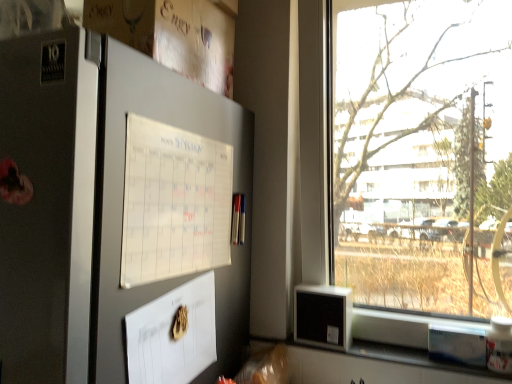
Question: Does white paper calendar at upper left have a smaller size compared to satin silver fridge at left?

Choices:
 (A) no
 (B) yes

Answer: (B)

Question: Is white paper calendar at upper left positioned before satin silver fridge at left?

Choices:
 (A) no
 (B) yes

Answer: (A)

Question: Is white paper calendar at upper left taller than satin silver fridge at left?

Choices:
 (A) no
 (B) yes

Answer: (A)

Question: Could satin silver fridge at left be considered to be inside white paper calendar at upper left?

Choices:
 (A) yes
 (B) no

Answer: (B)

Question: From the image's perspective, is white paper calendar at upper left on satin silver fridge at left?

Choices:
 (A) yes
 (B) no

Answer: (A)

Question: Is white paper calendar at upper left behind satin silver fridge at left?

Choices:
 (A) yes
 (B) no

Answer: (A)

Question: Is white paper calendar at upper left surrounded by satin silver fridge at left?

Choices:
 (A) no
 (B) yes

Answer: (A)

Question: Is satin silver fridge at left closer to the viewer compared to white paper calendar at upper left?

Choices:
 (A) no
 (B) yes

Answer: (B)

Question: Can you confirm if satin silver fridge at left is smaller than white paper calendar at upper left?

Choices:
 (A) yes
 (B) no

Answer: (B)

Question: Can you confirm if satin silver fridge at left is positioned to the right of white paper calendar at upper left?

Choices:
 (A) yes
 (B) no

Answer: (B)

Question: Does satin silver fridge at left have a lesser height compared to white paper calendar at upper left?

Choices:
 (A) no
 (B) yes

Answer: (A)

Question: Does satin silver fridge at left turn towards white paper calendar at upper left?

Choices:
 (A) yes
 (B) no

Answer: (B)

Question: Can you confirm if white paper calendar at upper left is positioned to the left of transparent glass window at right?

Choices:
 (A) yes
 (B) no

Answer: (A)